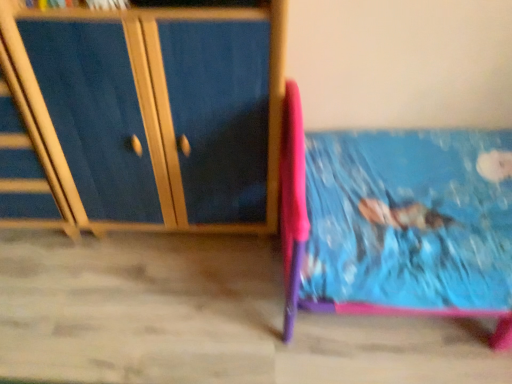
Question: Is blue wood cabinet at left wider or thinner than wooden drawer at left?

Choices:
 (A) thin
 (B) wide

Answer: (B)

Question: Considering their positions, is blue wood cabinet at left located in front of or behind wooden drawer at left?

Choices:
 (A) front
 (B) behind

Answer: (A)

Question: From a real-world perspective, is blue wood cabinet at left above or below wooden drawer at left?

Choices:
 (A) below
 (B) above

Answer: (B)

Question: Visually, is wooden drawer at left positioned to the left or to the right of blue wood cabinet at left?

Choices:
 (A) left
 (B) right

Answer: (A)

Question: From their relative heights in the image, would you say wooden drawer at left is taller or shorter than blue wood cabinet at left?

Choices:
 (A) short
 (B) tall

Answer: (A)

Question: Considering their positions, is wooden drawer at left located in front of or behind blue wood cabinet at left?

Choices:
 (A) behind
 (B) front

Answer: (A)

Question: From a real-world perspective, is wooden drawer at left above or below blue wood cabinet at left?

Choices:
 (A) below
 (B) above

Answer: (A)